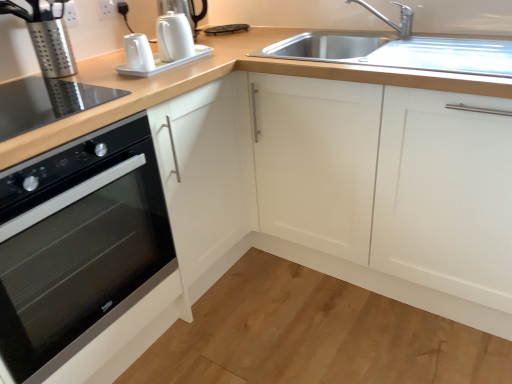
Question: Considering the relative sizes of white glossy coffee machine at upper center, the 2th coffee machine positioned from the left, and white matte cabinet at upper right in the image provided, is white glossy coffee machine at upper center, the 2th coffee machine positioned from the left, thinner than white matte cabinet at upper right?

Choices:
 (A) no
 (B) yes

Answer: (B)

Question: Are white glossy coffee machine at upper center, the 2th coffee machine positioned from the left, and white matte cabinet at upper right located far from each other?

Choices:
 (A) no
 (B) yes

Answer: (A)

Question: Is white glossy coffee machine at upper center, the 2th coffee machine positioned from the left, turned away from white matte cabinet at upper right?

Choices:
 (A) yes
 (B) no

Answer: (B)

Question: Is white glossy coffee machine at upper center, the 1th coffee machine from the right, closer to the viewer compared to white matte cabinet at upper right?

Choices:
 (A) yes
 (B) no

Answer: (B)

Question: Is white glossy coffee machine at upper center, the 2th coffee machine positioned from the left, wider than white matte cabinet at upper right?

Choices:
 (A) no
 (B) yes

Answer: (A)

Question: Is white glossy coffee machine at upper center, the 2th coffee machine positioned from the left, oriented towards white matte cabinet at upper right?

Choices:
 (A) yes
 (B) no

Answer: (B)

Question: From a real-world perspective, is silver metallic faucet at upper right below black glass oven at left?

Choices:
 (A) no
 (B) yes

Answer: (A)

Question: From a real-world perspective, is silver metallic faucet at upper right over black glass oven at left?

Choices:
 (A) no
 (B) yes

Answer: (B)

Question: Is silver metallic faucet at upper right aimed at black glass oven at left?

Choices:
 (A) yes
 (B) no

Answer: (B)

Question: Can we say silver metallic faucet at upper right lies outside black glass oven at left?

Choices:
 (A) yes
 (B) no

Answer: (A)

Question: Does silver metallic faucet at upper right have a greater width compared to black glass oven at left?

Choices:
 (A) yes
 (B) no

Answer: (B)

Question: Is silver metallic faucet at upper right thinner than black glass oven at left?

Choices:
 (A) yes
 (B) no

Answer: (A)

Question: Is black glass oven at left taller than white glossy coffee machine at upper center, the 1th coffee machine from the right?

Choices:
 (A) yes
 (B) no

Answer: (A)